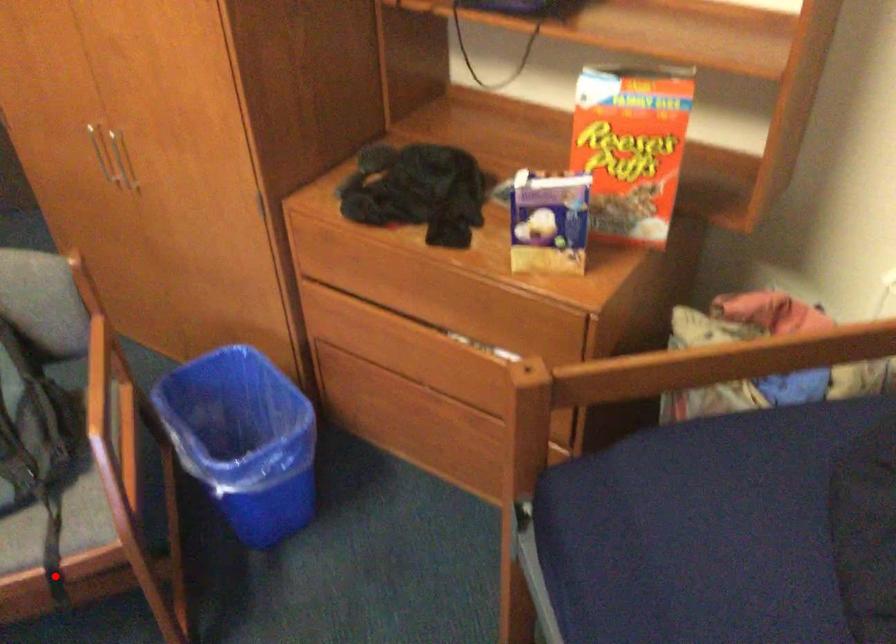
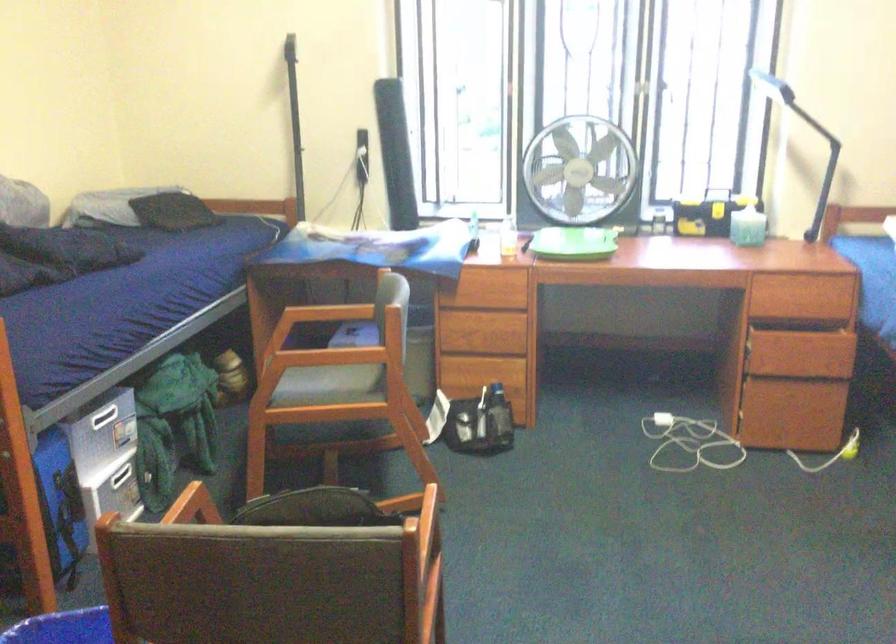
Question: I am providing you with two images of the same scene from different viewpoints. A red point is marked on the first image. Can you still see the location of the red point in image 2?

Choices:
 (A) Yes
 (B) No

Answer: (B)